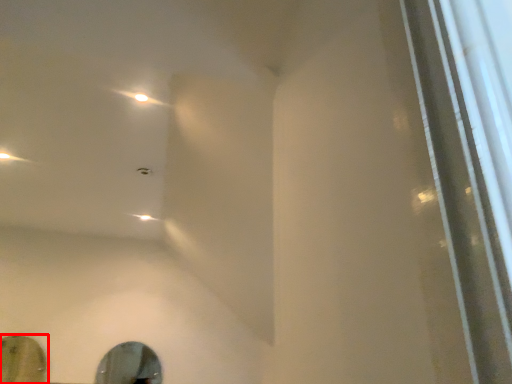
Question: Observing the image, what is the correct spatial positioning of mirror (annotated by the red box) in reference to mirror?

Choices:
 (A) left
 (B) right

Answer: (A)